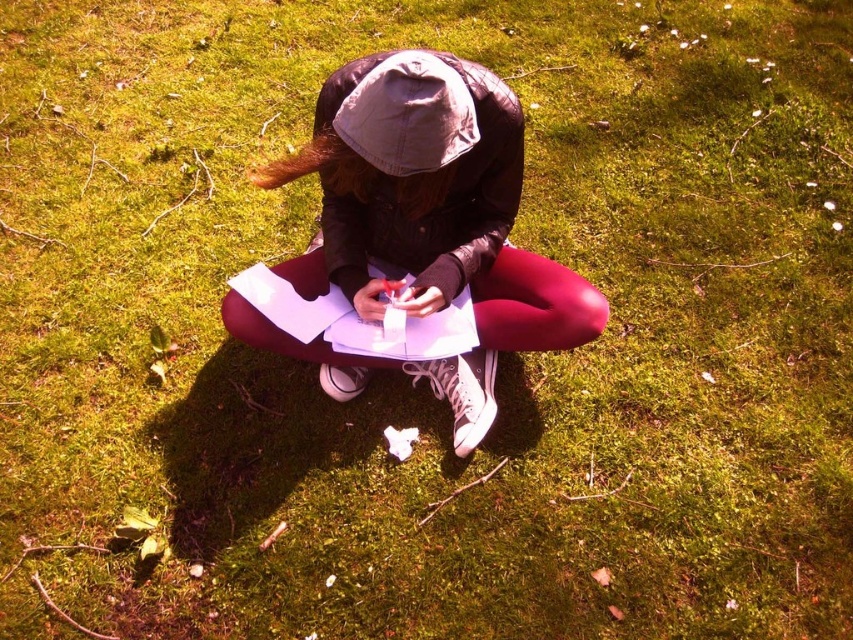
You are a fashion designer observing the person in the scene. You need to determine if the distance between the matte black jacket at center and the light gray fabric hat at center is sufficient to place a 6.5 inches wide accessory between them. Can you fit the accessory?

The distance between the matte black jacket at center and the light gray fabric hat at center is 6.57 inches. Since the accessory is 6.5 inches wide, it can fit between them with a small amount of space remaining.

You are a fashion designer observing the person in the scene. You need to determine the correct order of the matte black jacket at center and the light gray fabric hat at center from top to bottom. Which one is positioned higher?

The light gray fabric hat at center is positioned higher than the matte black jacket at center since the jacket is below the hat.